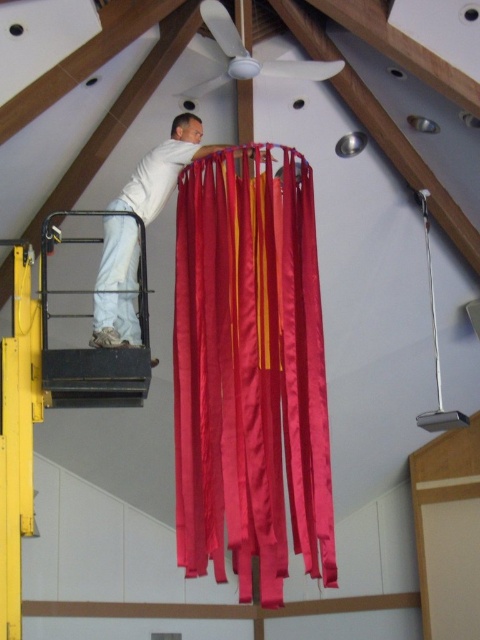
Is black metal lift at lower left to the left of white matte fan at upper center from the viewer's perspective?

Indeed, black metal lift at lower left is positioned on the left side of white matte fan at upper center.

Who is more forward, (121, 387) or (322, 64)?

Point (121, 387) is more forward.

This screenshot has height=640, width=480. In order to click on black metal lift at lower left in this screenshot , I will do point(91,348).

Who is positioned more to the left, white matte pants at center or black metal lift at lower left?

black metal lift at lower left

Does white matte pants at center appear over black metal lift at lower left?

Yes, white matte pants at center is above black metal lift at lower left.

Between point (109, 227) and point (46, 307), which one is positioned in front?

Point (46, 307)

The height and width of the screenshot is (640, 480). Find the location of `white matte pants at center`. white matte pants at center is located at coordinates (117, 285).

Looking at this image, is satin red curtain at center above black metal lift at lower left?

No, satin red curtain at center is not above black metal lift at lower left.

Is point (320, 406) positioned before point (64, 387)?

That is False.

Does point (254, 234) come in front of point (56, 404)?

No, it is not.

Image resolution: width=480 pixels, height=640 pixels. I want to click on satin red curtain at center, so click(x=249, y=376).